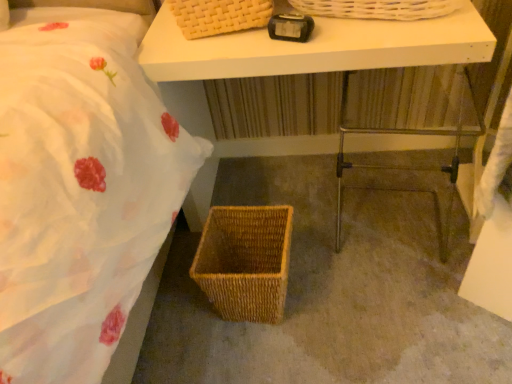
I want to click on vacant area that lies to the right of woven brown picnic basket at lower center, so coord(325,291).